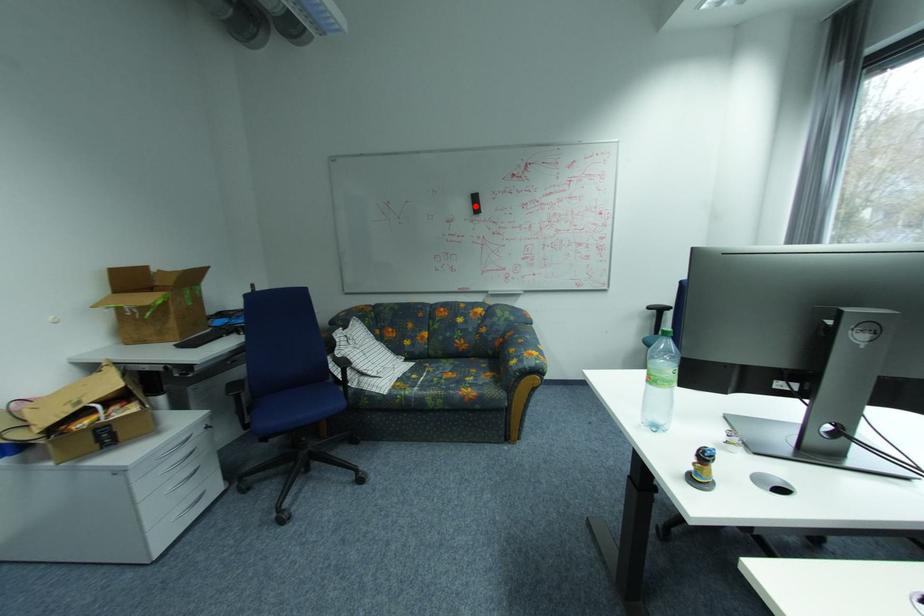
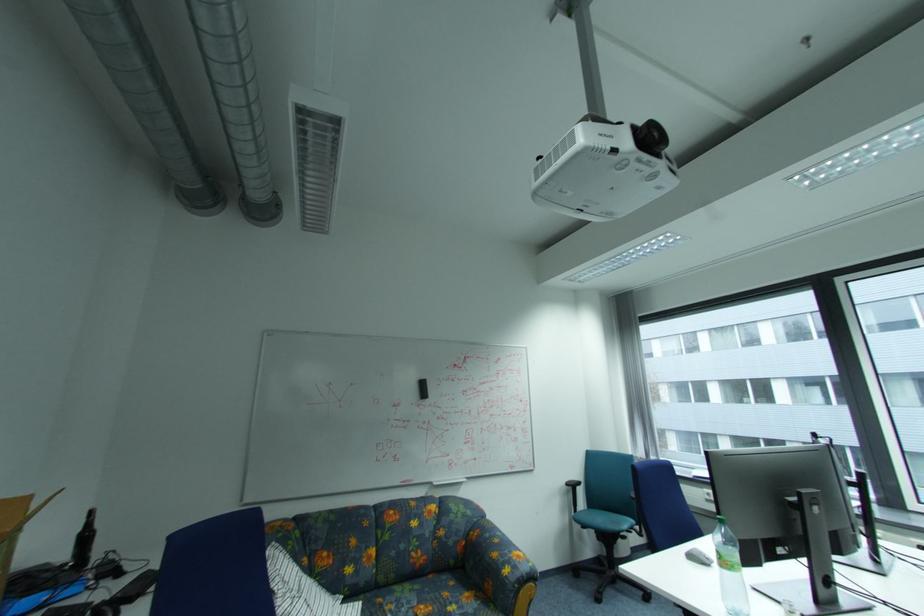
Question: I am providing you with two images of the same scene from different viewpoints. Given a red point in image1, look at the same physical point in image2. Is it:

Choices:
 (A) Closer to the viewpoint
 (B) Farther from the viewpoint

Answer: (B)